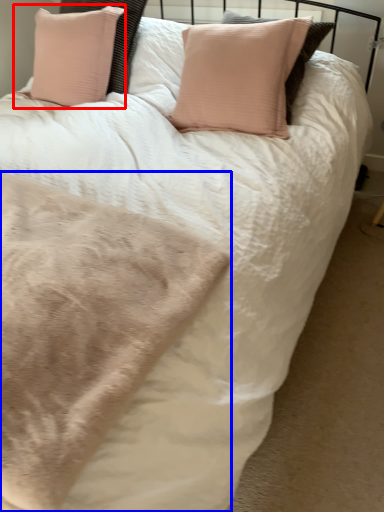
Question: Among these objects, which one is farthest to the camera, pillow (highlighted by a red box) or blanket (highlighted by a blue box)?

Choices:
 (A) pillow
 (B) blanket

Answer: (A)